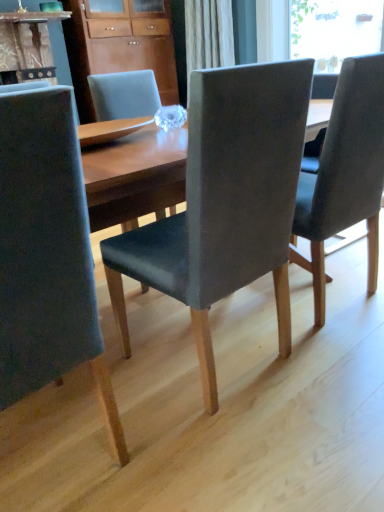
Question: Considering the relative sizes of dark gray fabric chair at center, acting as the third chair starting from the left, and matte gray chair at left, arranged as the 1th chair when viewed from the left, in the image provided, is dark gray fabric chair at center, acting as the third chair starting from the left, thinner than matte gray chair at left, arranged as the 1th chair when viewed from the left,?

Choices:
 (A) yes
 (B) no

Answer: (A)

Question: Can you confirm if dark gray fabric chair at center, acting as the third chair starting from the left, is taller than matte gray chair at left, which appears as the third chair when viewed from the right?

Choices:
 (A) yes
 (B) no

Answer: (B)

Question: Considering the relative sizes of dark gray fabric chair at center, acting as the 1th chair starting from the right, and matte gray chair at left, which appears as the third chair when viewed from the right, in the image provided, is dark gray fabric chair at center, acting as the 1th chair starting from the right, shorter than matte gray chair at left, which appears as the third chair when viewed from the right,?

Choices:
 (A) yes
 (B) no

Answer: (A)

Question: From a real-world perspective, does dark gray fabric chair at center, acting as the 1th chair starting from the right, sit lower than matte gray chair at left, arranged as the 1th chair when viewed from the left?

Choices:
 (A) no
 (B) yes

Answer: (B)

Question: Is dark gray fabric chair at center, acting as the third chair starting from the left, oriented away from matte gray chair at left, arranged as the 1th chair when viewed from the left?

Choices:
 (A) yes
 (B) no

Answer: (B)

Question: Is dark gray fabric chair at center, acting as the third chair starting from the left, directly adjacent to matte gray chair at left, which appears as the third chair when viewed from the right?

Choices:
 (A) no
 (B) yes

Answer: (A)

Question: Is dark gray fabric chair at center, acting as the third chair starting from the left, to the left of matte wood cabinet at upper center from the viewer's perspective?

Choices:
 (A) yes
 (B) no

Answer: (B)

Question: Is dark gray fabric chair at center, acting as the 1th chair starting from the right, completely or partially outside of matte wood cabinet at upper center?

Choices:
 (A) no
 (B) yes

Answer: (B)

Question: Is the depth of dark gray fabric chair at center, acting as the third chair starting from the left, less than that of matte wood cabinet at upper center?

Choices:
 (A) no
 (B) yes

Answer: (B)

Question: Is dark gray fabric chair at center, acting as the third chair starting from the left, thinner than matte wood cabinet at upper center?

Choices:
 (A) no
 (B) yes

Answer: (A)

Question: Is dark gray fabric chair at center, acting as the third chair starting from the left, to the right of matte wood cabinet at upper center from the viewer's perspective?

Choices:
 (A) no
 (B) yes

Answer: (B)

Question: From the image's perspective, would you say dark gray fabric chair at center, acting as the third chair starting from the left, is shown under matte wood cabinet at upper center?

Choices:
 (A) no
 (B) yes

Answer: (B)

Question: Does matte wood cabinet at upper center have a smaller size compared to matte gray chair at center, acting as the second chair starting from the left?

Choices:
 (A) no
 (B) yes

Answer: (A)